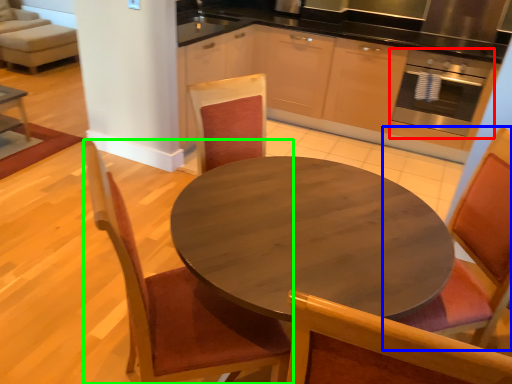
Question: Which object is the farthest from oven (highlighted by a red box)? Choose among these: chair (highlighted by a blue box) or chair (highlighted by a green box).

Choices:
 (A) chair
 (B) chair

Answer: (B)